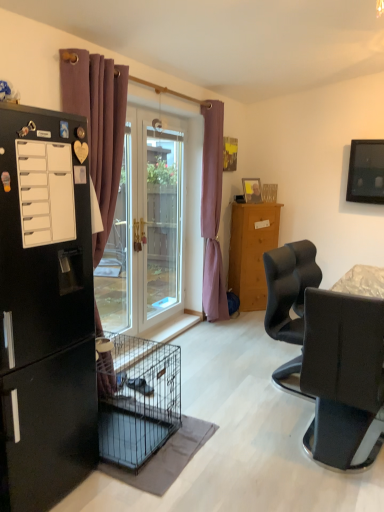
Question: Which direction should I rotate to look at purple fabric curtain at center, acting as the 1th curtain starting from the right, — up or down?

Choices:
 (A) down
 (B) up

Answer: (B)

Question: Is transparent glass screen door at center bigger than matte black refrigerator at center?

Choices:
 (A) yes
 (B) no

Answer: (B)

Question: Is transparent glass screen door at center positioned before matte black refrigerator at center?

Choices:
 (A) no
 (B) yes

Answer: (B)

Question: Is transparent glass screen door at center outside matte black refrigerator at center?

Choices:
 (A) yes
 (B) no

Answer: (A)

Question: Considering the relative sizes of transparent glass screen door at center and matte black refrigerator at center in the image provided, is transparent glass screen door at center wider than matte black refrigerator at center?

Choices:
 (A) yes
 (B) no

Answer: (B)

Question: Are transparent glass screen door at center and matte black refrigerator at center making contact?

Choices:
 (A) yes
 (B) no

Answer: (B)

Question: Does transparent glass screen door at center appear on the right side of matte black refrigerator at center?

Choices:
 (A) no
 (B) yes

Answer: (A)

Question: Are transparent glass screen door at center and purple fabric curtain at left, the 1th curtain positioned from the left, beside each other?

Choices:
 (A) no
 (B) yes

Answer: (A)

Question: Is transparent glass screen door at center turned away from purple fabric curtain at left, which is the 2th curtain in right-to-left order?

Choices:
 (A) no
 (B) yes

Answer: (A)

Question: Is the position of transparent glass screen door at center less distant than that of purple fabric curtain at left, the 1th curtain positioned from the left?

Choices:
 (A) no
 (B) yes

Answer: (A)

Question: Does transparent glass screen door at center have a lesser width compared to purple fabric curtain at left, the 1th curtain positioned from the left?

Choices:
 (A) no
 (B) yes

Answer: (B)

Question: Can you confirm if transparent glass screen door at center is shorter than purple fabric curtain at left, acting as the second curtain starting from the back?

Choices:
 (A) no
 (B) yes

Answer: (B)

Question: From a real-world perspective, is transparent glass screen door at center located higher than purple fabric curtain at left, acting as the second curtain starting from the back?

Choices:
 (A) no
 (B) yes

Answer: (A)

Question: From a real-world perspective, is matte black television at upper right under white matte drawer at left?

Choices:
 (A) yes
 (B) no

Answer: (B)